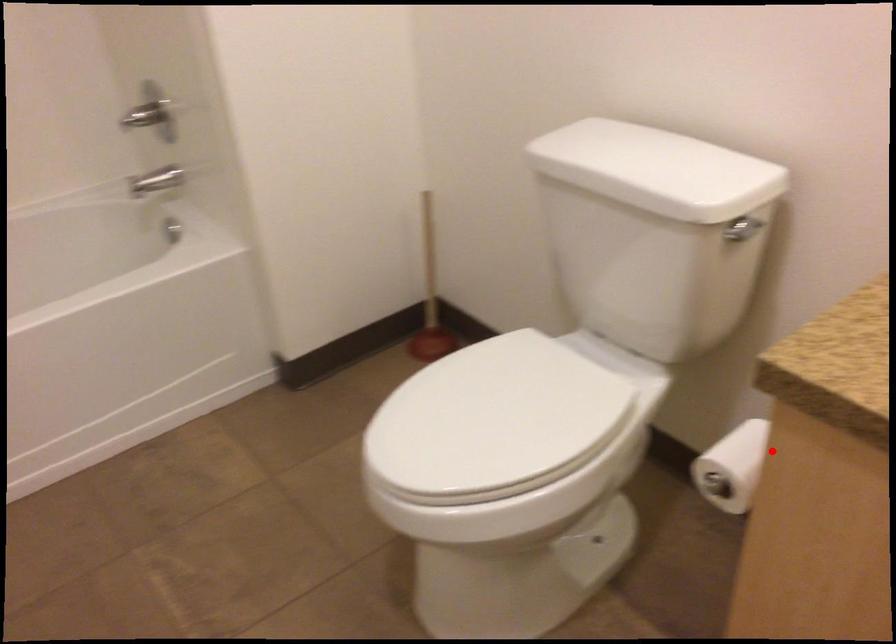
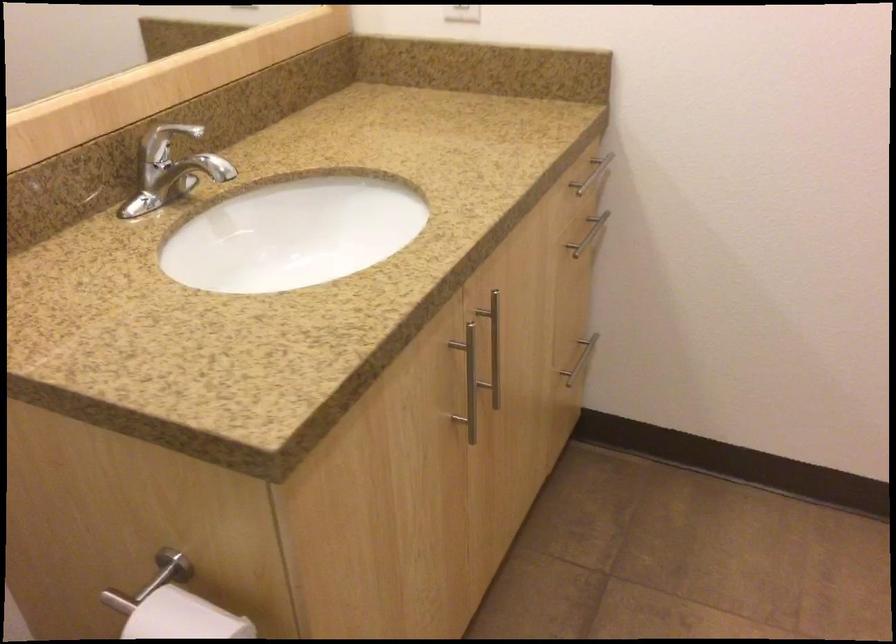
In the second image, find the point that corresponds to the highlighted location in the first image.

(183, 618)